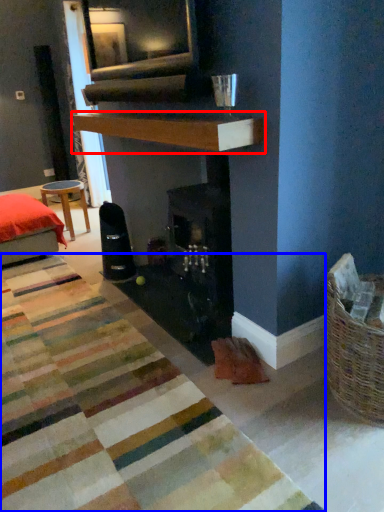
Question: Which object is closer to the camera taking this photo, mantle (highlighted by a red box) or mat (highlighted by a blue box)?

Choices:
 (A) mantle
 (B) mat

Answer: (B)